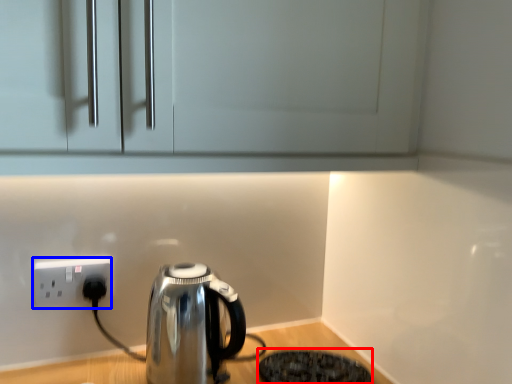
Question: Which object appears farthest to the camera in this image, appliance (highlighted by a red box) or power plugs and sockets (highlighted by a blue box)?

Choices:
 (A) appliance
 (B) power plugs and sockets

Answer: (B)